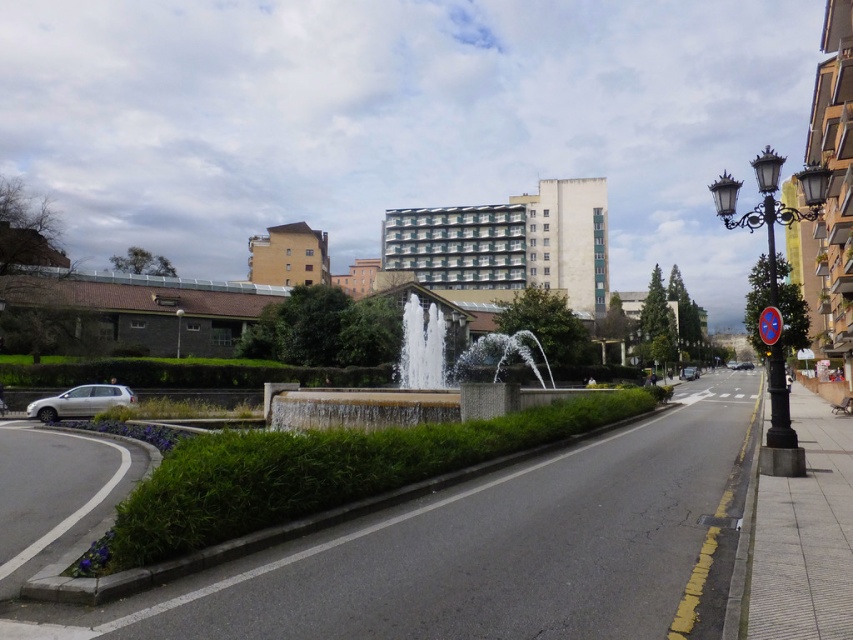
You are a city planner assessing the central square. You need to determine if the shiny silver sedan at center can be parked perpendicular to the white stone fountain at center without overlapping. Given their widths, can this arrangement fit?

The white stone fountain at center is wider than the shiny silver sedan at center. Since the fountain is wider, parking the sedan perpendicular might still be possible depending on the available space around the fountain. However, the exact feasibility requires knowing the total area dimensions, which aren

You are standing at the center of the fountain and want to look at the beige concrete building at upper center. In which direction should you turn your head to look at it?

You should look upwards and towards the center of the image to see the beige concrete building at upper center, as it is located at point coordinates of (288, 256).